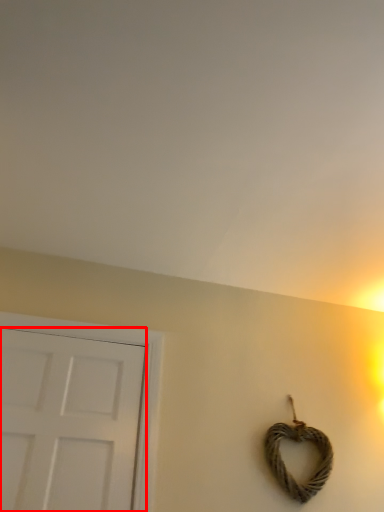
Question: From the image's perspective, where is door (annotated by the red box) located in relation to rope in the image?

Choices:
 (A) below
 (B) above

Answer: (B)